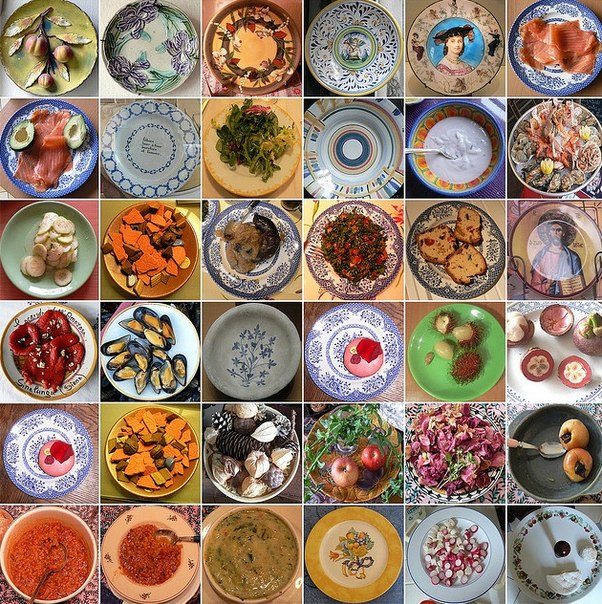
I want to click on empty plate, so click(348, 545), click(253, 353), click(147, 161), click(357, 158), click(358, 60), click(253, 52), click(149, 40), click(460, 48).